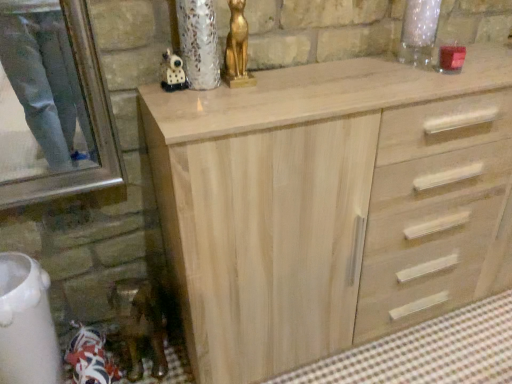
This screenshot has width=512, height=384. Describe the element at coordinates (330, 205) in the screenshot. I see `natural wood cabinet at center` at that location.

Where is `metallic gold figurine at lower left, the 1th miniature when ordered from bottom to top`? metallic gold figurine at lower left, the 1th miniature when ordered from bottom to top is located at coordinates (139, 324).

Find the location of a particular element. This screenshot has height=384, width=512. gold metallic cat statue at upper center is located at coordinates (x=237, y=48).

Is point (251, 245) positioned after point (141, 334)?

No, (251, 245) is closer to viewer.

Is the position of natural wood cabinet at center less distant than that of metallic gold figurine at lower left, which ranks as the first miniature in back-to-front order?

Yes, natural wood cabinet at center is closer to the viewer.

Considering the relative sizes of natural wood cabinet at center and metallic gold figurine at lower left, the 1th miniature when ordered from bottom to top, in the image provided, is natural wood cabinet at center wider than metallic gold figurine at lower left, the 1th miniature when ordered from bottom to top,?

Correct, the width of natural wood cabinet at center exceeds that of metallic gold figurine at lower left, the 1th miniature when ordered from bottom to top.

Which is correct: metallic gold figurine at lower left, acting as the first miniature starting from the left, is inside natural wood cabinet at center, or outside of it?

metallic gold figurine at lower left, acting as the first miniature starting from the left, is outside natural wood cabinet at center.

Could you tell me if metallic gold figurine at lower left, acting as the first miniature starting from the left, is facing natural wood cabinet at center?

No, metallic gold figurine at lower left, acting as the first miniature starting from the left, is not turned towards natural wood cabinet at center.

Considering the points (142, 338) and (193, 199), which point is in front, point (142, 338) or point (193, 199)?

Positioned in front is point (193, 199).

Is metallic gold figurine at lower left, which ranks as the first miniature in back-to-front order, completely or partially outside of gold metallic cat statue at upper center?

Indeed, metallic gold figurine at lower left, which ranks as the first miniature in back-to-front order, is completely outside gold metallic cat statue at upper center.

Is metallic gold figurine at lower left, the 1th miniature when ordered from bottom to top, aimed at gold metallic cat statue at upper center?

No, metallic gold figurine at lower left, the 1th miniature when ordered from bottom to top, is not turned towards gold metallic cat statue at upper center.

Can you confirm if metallic gold figurine at lower left, acting as the first miniature starting from the left, is wider than gold metallic cat statue at upper center?

Yes, metallic gold figurine at lower left, acting as the first miniature starting from the left, is wider than gold metallic cat statue at upper center.

From a real-world perspective, is metallic gold figurine at lower left, the 1th miniature when ordered from bottom to top, positioned above or below gold metallic cat statue at upper center?

Clearly, from a real-world perspective, metallic gold figurine at lower left, the 1th miniature when ordered from bottom to top, is below gold metallic cat statue at upper center.

Considering the positions of objects matte black figurine at upper center, which ranks as the 2th miniature in left-to-right order, and natural wood cabinet at center in the image provided, who is behind, matte black figurine at upper center, which ranks as the 2th miniature in left-to-right order, or natural wood cabinet at center?

matte black figurine at upper center, which ranks as the 2th miniature in left-to-right order, is more distant.

How distant is matte black figurine at upper center, positioned as the 1th miniature in right-to-left order, from natural wood cabinet at center?

A distance of 23.55 inches exists between matte black figurine at upper center, positioned as the 1th miniature in right-to-left order, and natural wood cabinet at center.

What's the angular difference between matte black figurine at upper center, which is the 2th miniature in back-to-front order, and natural wood cabinet at center's facing directions?

matte black figurine at upper center, which is the 2th miniature in back-to-front order, and natural wood cabinet at center are facing 11.1 degrees away from each other.

From the image's perspective, is matte black figurine at upper center, which ranks as the 2th miniature in left-to-right order, located above natural wood cabinet at center?

Indeed, from the image's perspective, matte black figurine at upper center, which ranks as the 2th miniature in left-to-right order, is shown above natural wood cabinet at center.

Are metallic gold figurine at lower left, the second miniature positioned from the right, and matte black figurine at upper center, which is the 2th miniature in back-to-front order, beside each other?

They are not placed beside each other.

Considering the points (165, 360) and (182, 78), which point is behind, point (165, 360) or point (182, 78)?

Point (165, 360)

Which is correct: metallic gold figurine at lower left, the 1th miniature when ordered from bottom to top, is inside matte black figurine at upper center, positioned as the 1th miniature in right-to-left order, or outside of it?

metallic gold figurine at lower left, the 1th miniature when ordered from bottom to top, is not enclosed by matte black figurine at upper center, positioned as the 1th miniature in right-to-left order.

There is a metallic gold figurine at lower left, which ranks as the first miniature in back-to-front order. Identify the location of miniature above it (from a real-world perspective). The image size is (512, 384). (172, 72).

Can you tell me how much matte black figurine at upper center, positioned as the 1th miniature in right-to-left order, and gold metallic cat statue at upper center differ in facing direction?

The angle between the facing direction of matte black figurine at upper center, positioned as the 1th miniature in right-to-left order, and the facing direction of gold metallic cat statue at upper center is 12.3 degrees.

Between matte black figurine at upper center, which ranks as the 2th miniature in left-to-right order, and gold metallic cat statue at upper center, which one has larger width?

Wider between the two is gold metallic cat statue at upper center.

Is matte black figurine at upper center, which ranks as the 2th miniature in left-to-right order, not close to gold metallic cat statue at upper center?

No, matte black figurine at upper center, which ranks as the 2th miniature in left-to-right order, is not far from gold metallic cat statue at upper center.

Is matte black figurine at upper center, the first miniature from the front, completely or partially outside of gold metallic cat statue at upper center?

Yes, matte black figurine at upper center, the first miniature from the front, is located beyond the bounds of gold metallic cat statue at upper center.

From the image's perspective, does natural wood cabinet at center appear lower than matte black figurine at upper center, arranged as the 1th miniature when viewed from the top?

Correct, natural wood cabinet at center appears lower than matte black figurine at upper center, arranged as the 1th miniature when viewed from the top, in the image.

In the scene shown: Does natural wood cabinet at center have a greater height compared to matte black figurine at upper center, the first miniature from the front?

Yes, natural wood cabinet at center is taller than matte black figurine at upper center, the first miniature from the front.

Does point (482, 100) come farther from viewer compared to point (161, 63)?

No.

Is matte black figurine at upper center, positioned as the 1th miniature in right-to-left order, surrounded by natural wood cabinet at center?

No, matte black figurine at upper center, positioned as the 1th miniature in right-to-left order, is not surrounded by natural wood cabinet at center.

Which miniature is the 2nd one when counting from the back of the natural wood cabinet at center? Please provide its 2D coordinates.

[(139, 324)]

The height and width of the screenshot is (384, 512). In the image, there is a natural wood cabinet at center. Find the location of `miniature below it (from a real-world perspective)`. miniature below it (from a real-world perspective) is located at coordinates (139, 324).

Based on their spatial positions, is metallic gold figurine at lower left, the second miniature positioned from the right, or natural wood cabinet at center closer to matte black figurine at upper center, positioned as the 1th miniature in right-to-left order?

natural wood cabinet at center.

Which object lies nearer to the anchor point gold metallic cat statue at upper center, natural wood cabinet at center or matte black figurine at upper center, arranged as the 1th miniature when viewed from the top?

matte black figurine at upper center, arranged as the 1th miniature when viewed from the top, is positioned closer to the anchor gold metallic cat statue at upper center.

Looking at the image, which one is located further to natural wood cabinet at center, matte black figurine at upper center, the first miniature from the front, or metallic gold figurine at lower left, acting as the first miniature starting from the left?

matte black figurine at upper center, the first miniature from the front, is further to natural wood cabinet at center.

Looking at the image, which one is located further to natural wood cabinet at center, gold metallic cat statue at upper center or metallic gold figurine at lower left, the 1th miniature when ordered from bottom to top?

The object further to natural wood cabinet at center is metallic gold figurine at lower left, the 1th miniature when ordered from bottom to top.

Which object lies further to the anchor point matte black figurine at upper center, which ranks as the 2th miniature in left-to-right order, natural wood cabinet at center or gold metallic cat statue at upper center?

Among the two, natural wood cabinet at center is located further to matte black figurine at upper center, which ranks as the 2th miniature in left-to-right order.

From the image, which object appears to be farther from metallic gold figurine at lower left, positioned as the 2th miniature in front-to-back order, natural wood cabinet at center or gold metallic cat statue at upper center?

gold metallic cat statue at upper center is positioned further to the anchor metallic gold figurine at lower left, positioned as the 2th miniature in front-to-back order.

Considering their positions, is gold metallic cat statue at upper center positioned closer to metallic gold figurine at lower left, the second miniature positioned from the right, than matte black figurine at upper center, the first miniature from the front?

matte black figurine at upper center, the first miniature from the front, is closer to metallic gold figurine at lower left, the second miniature positioned from the right.

Based on their spatial positions, is gold metallic cat statue at upper center or natural wood cabinet at center further from matte black figurine at upper center, which ranks as the 2th miniature in left-to-right order?

natural wood cabinet at center lies further to matte black figurine at upper center, which ranks as the 2th miniature in left-to-right order, than the other object.

The width and height of the screenshot is (512, 384). What are the coordinates of `miniature situated between metallic gold figurine at lower left, which ranks as the first miniature in back-to-front order, and natural wood cabinet at center from left to right` in the screenshot? It's located at (172, 72).

You are a GUI agent. You are given a task and a screenshot of the screen. Output one action in this format:
    pyautogui.click(x=<x>, y=<y>)
    Task: Click on the miniature between gold metallic cat statue at upper center and metallic gold figurine at lower left, the 1th miniature when ordered from bottom to top, in the vertical direction
    This screenshot has height=384, width=512.
    Given the screenshot: What is the action you would take?
    point(172,72)

Where is `sculpture between metallic gold figurine at lower left, the second miniature positioned from the right, and natural wood cabinet at center`? sculpture between metallic gold figurine at lower left, the second miniature positioned from the right, and natural wood cabinet at center is located at coordinates (237, 48).

Locate an element on the screen. This screenshot has width=512, height=384. sculpture situated between matte black figurine at upper center, positioned as the 1th miniature in right-to-left order, and natural wood cabinet at center from left to right is located at coordinates (237, 48).